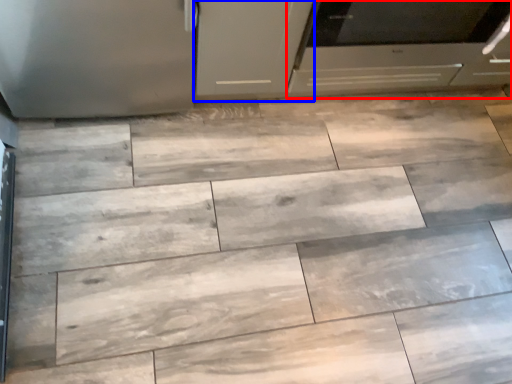
Question: Which point is further to the camera, oven (highlighted by a red box) or cabinetry (highlighted by a blue box)?

Choices:
 (A) oven
 (B) cabinetry

Answer: (A)